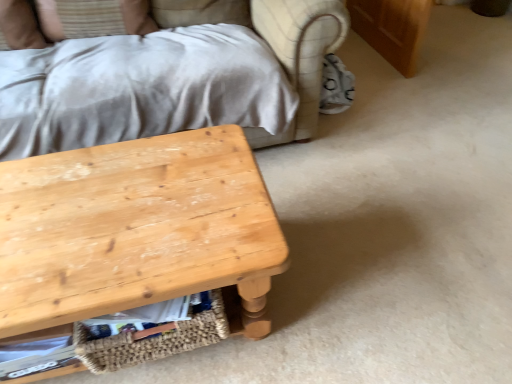
Find the location of a particular element. blank space above natural wood table at lower left (from a real-world perspective) is located at coordinates pos(115,204).